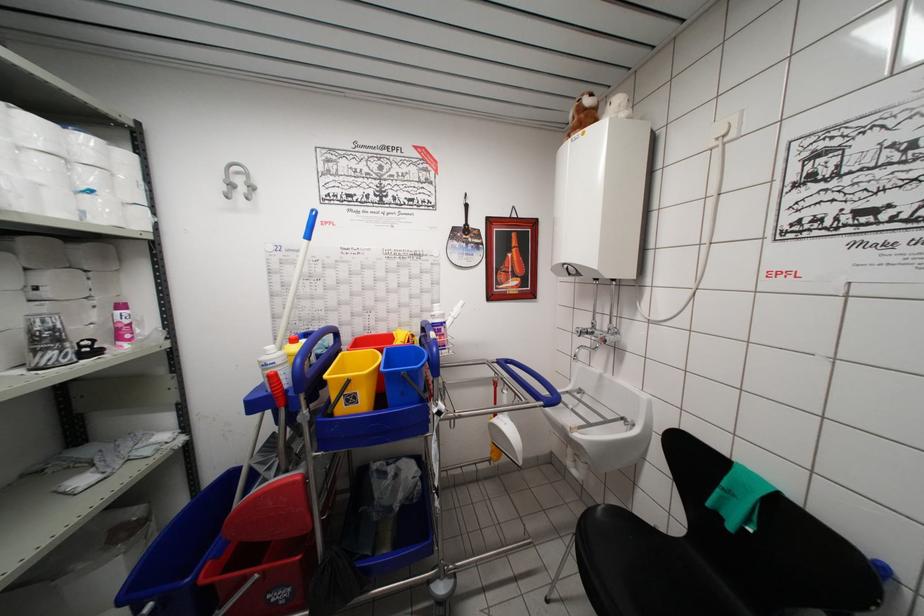
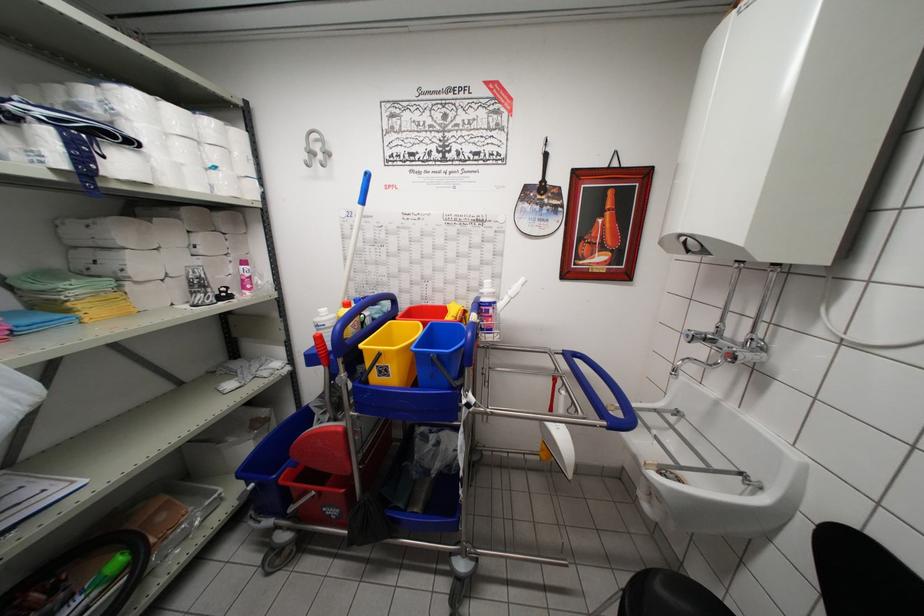
The images are taken continuously from a first-person perspective. In which direction are you moving?

The cameraman moved toward right, forward.